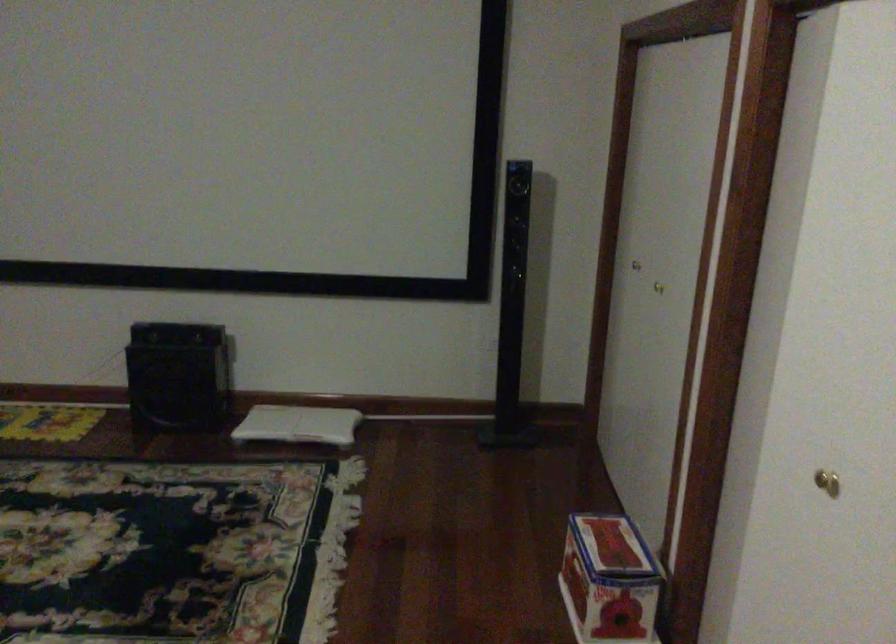
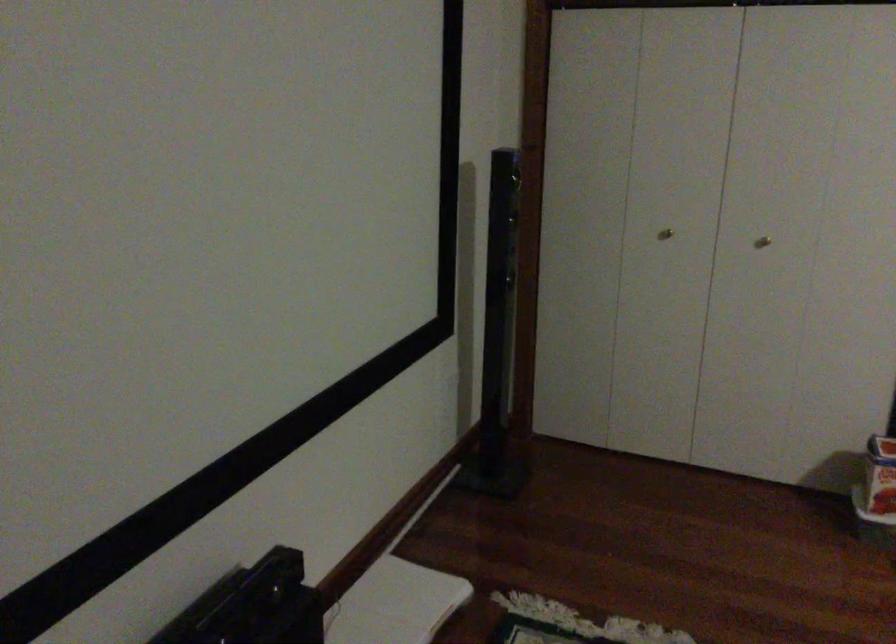
Where in the second image is the point corresponding to pixel 652 292 from the first image?

(762, 242)